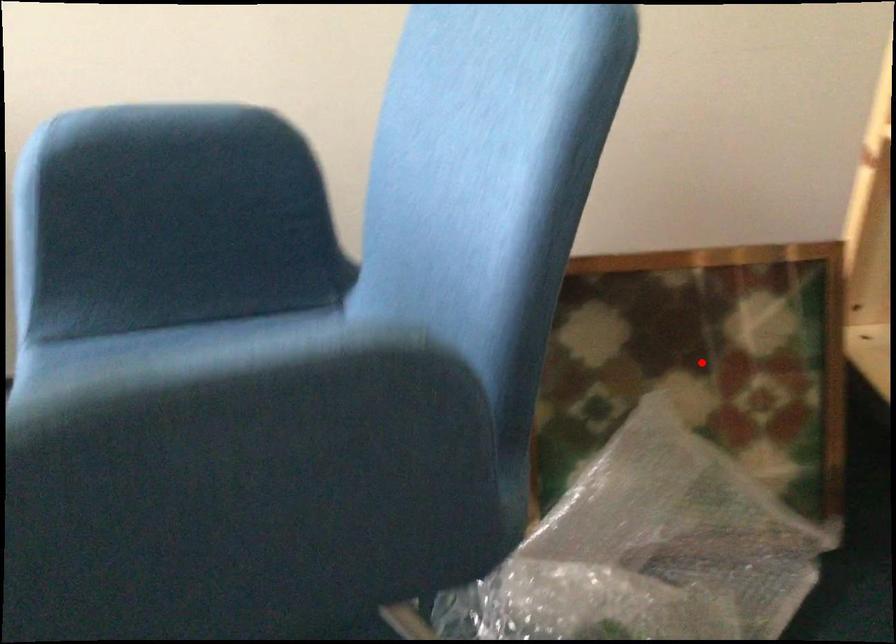
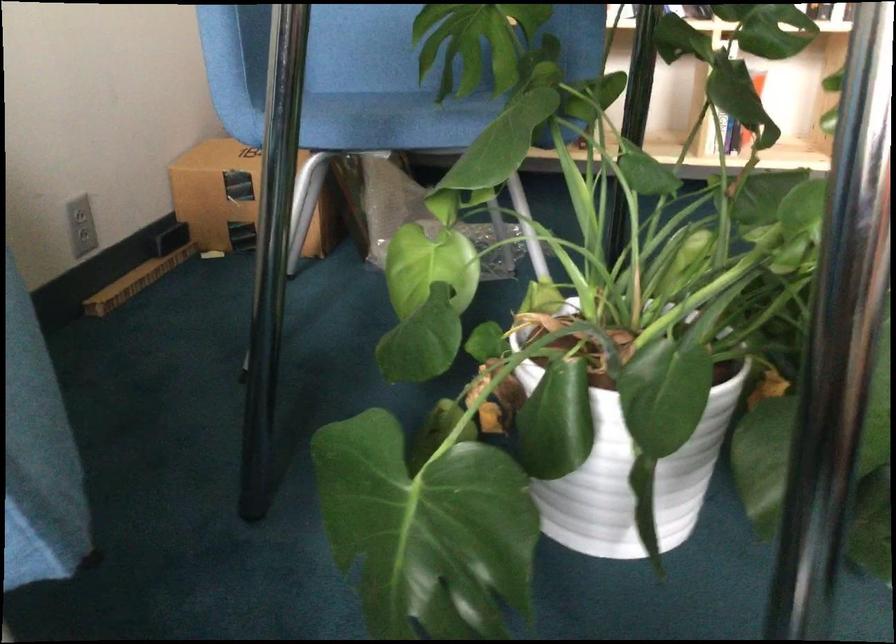
Question: I am providing you with two images of the same scene from different viewpoints. A red point is marked on the first image. Can you still see the location of the red point in image 2?

Choices:
 (A) Yes
 (B) No

Answer: (B)